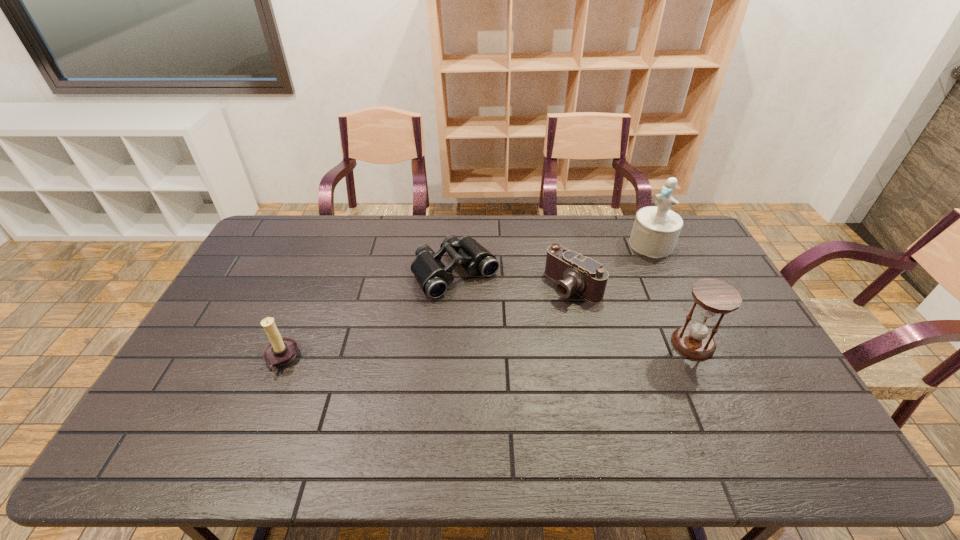
Locate an element on the screen. binoculars located in the far edge section of the desktop is located at coordinates (433, 276).

Where is `hourglass at the right edge`? This screenshot has width=960, height=540. hourglass at the right edge is located at coordinates (714, 297).

Where is `figurine that is at the right edge`? figurine that is at the right edge is located at coordinates (656, 229).

Locate an element on the screen. object that is at the far right corner is located at coordinates (656, 229).

The image size is (960, 540). In the image, there is a desktop. In order to click on free space at the far edge in this screenshot , I will do `click(377, 252)`.

I want to click on free space at the near edge of the desktop, so click(x=310, y=405).

The width and height of the screenshot is (960, 540). In order to click on free region at the left edge in this screenshot , I will do [x=218, y=330].

The width and height of the screenshot is (960, 540). I want to click on vacant space at the right edge of the desktop, so click(x=703, y=263).

Locate an element on the screen. vacant space at the far left corner of the desktop is located at coordinates (284, 252).

This screenshot has width=960, height=540. In the image, there is a desktop. In order to click on free space at the far right corner in this screenshot , I will do `click(683, 228)`.